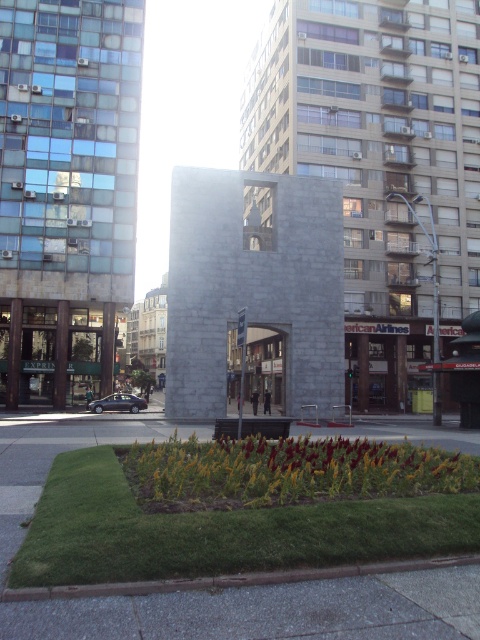
Question: Among these points, which one is farthest from the camera?

Choices:
 (A) (289, 548)
 (B) (0, 609)

Answer: (A)

Question: Does green grass at lower center have a smaller size compared to vibrant yellow-green foliage at center?

Choices:
 (A) no
 (B) yes

Answer: (B)

Question: Is green grass at lower center bigger than gray concrete pavement at lower center?

Choices:
 (A) no
 (B) yes

Answer: (B)

Question: Which object is farther from the camera taking this photo?

Choices:
 (A) green grass at lower center
 (B) vibrant yellow-green foliage at center
 (C) gray concrete pavement at lower center

Answer: (B)

Question: Can you confirm if green grass at lower center is positioned to the right of gray concrete pavement at lower center?

Choices:
 (A) yes
 (B) no

Answer: (B)

Question: Which object is closer to the camera taking this photo?

Choices:
 (A) green grass at lower center
 (B) vibrant yellow-green foliage at center
 (C) gray concrete pavement at lower center

Answer: (C)